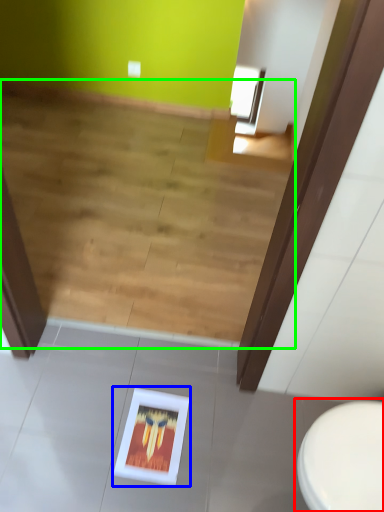
Question: Which is farther away from toilet (highlighted by a red box)? picture frame (highlighted by a blue box) or stairwell (highlighted by a green box)?

Choices:
 (A) picture frame
 (B) stairwell

Answer: (B)